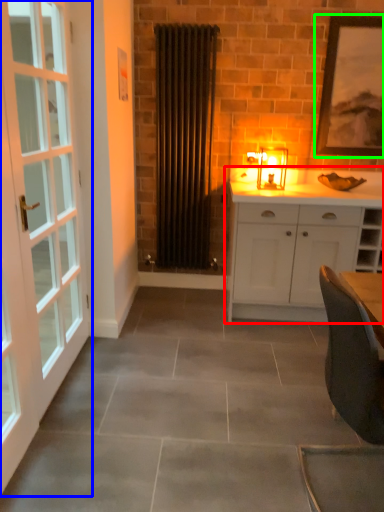
Question: Based on their relative distances, which object is farther from cabinetry (highlighted by a red box)? Choose from door (highlighted by a blue box) and picture frame (highlighted by a green box).

Choices:
 (A) door
 (B) picture frame

Answer: (A)